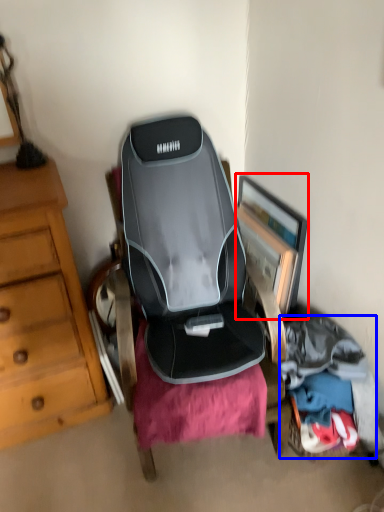
Question: Which object appears closest to the camera in this image, picture frame (highlighted by a red box) or clothing (highlighted by a blue box)?

Choices:
 (A) picture frame
 (B) clothing

Answer: (B)